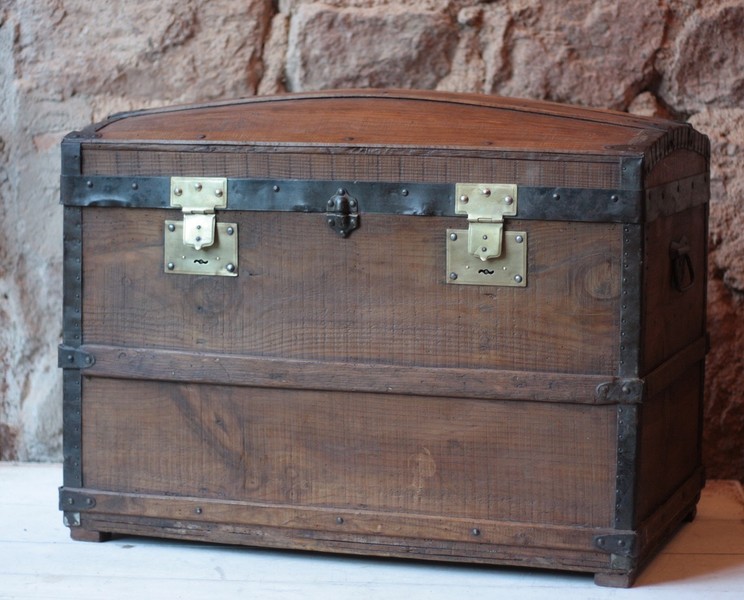
Where is `lock`? This screenshot has height=600, width=744. lock is located at coordinates (341, 209).